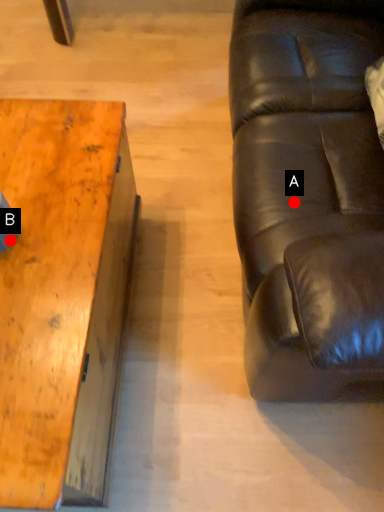
Question: Two points are circled on the image, labeled by A and B beside each circle. Which of the following is the closest to the observer?

Choices:
 (A) A is closer
 (B) B is closer

Answer: (B)